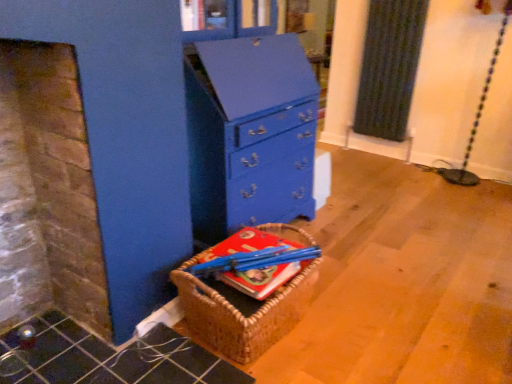
Question: From the image's perspective, is blue painted wood chest of drawers at center positioned above or below hardcover book at center?

Choices:
 (A) above
 (B) below

Answer: (A)

Question: Is blue painted wood chest of drawers at center inside or outside of hardcover book at center?

Choices:
 (A) outside
 (B) inside

Answer: (A)

Question: Based on their relative distances, which object is farther from the woven brown basket at lower left?

Choices:
 (A) hardcover book at center
 (B) blue painted wood chest of drawers at center

Answer: (B)

Question: Based on their relative distances, which object is nearer to the hardcover book at center?

Choices:
 (A) woven brown basket at lower left
 (B) blue painted wood chest of drawers at center

Answer: (A)